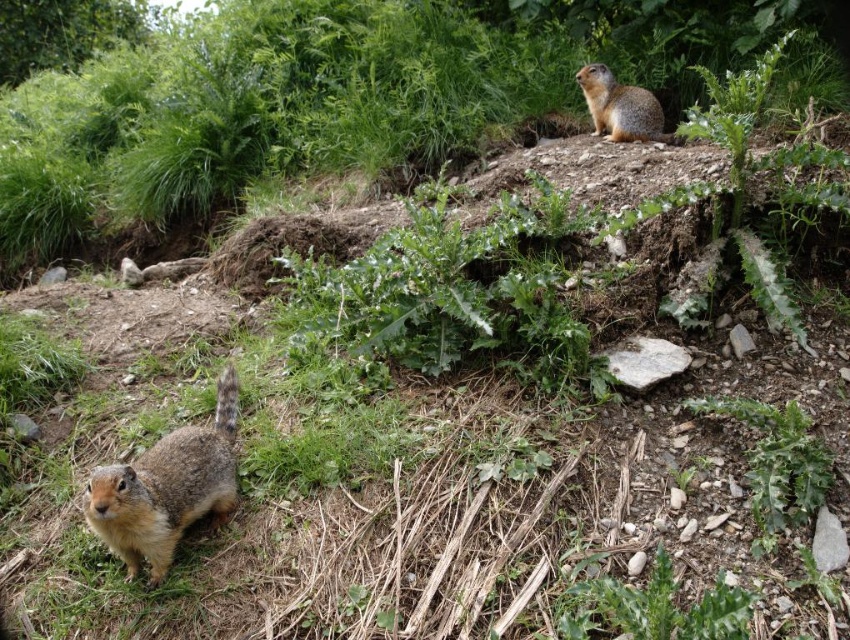
This screenshot has height=640, width=850. In order to click on green leafy plants at upper center in this screenshot , I will do `click(259, 116)`.

Is green leafy plants at upper center positioned before brown fur squirrel at lower left?

That is False.

Where is `green leafy plants at upper center`? This screenshot has width=850, height=640. green leafy plants at upper center is located at coordinates (259, 116).

Does green leafy plants at upper center have a greater height compared to brown fur squirrel at upper right?

Correct, green leafy plants at upper center is much taller as brown fur squirrel at upper right.

Identify the location of green leafy plants at upper center. (259, 116).

What do you see at coordinates (166, 486) in the screenshot? I see `brown fur squirrel at lower left` at bounding box center [166, 486].

Between point (171, 474) and point (609, 84), which one is positioned behind?

Positioned behind is point (609, 84).

Find the location of a particular element. brown fur squirrel at lower left is located at coordinates (166, 486).